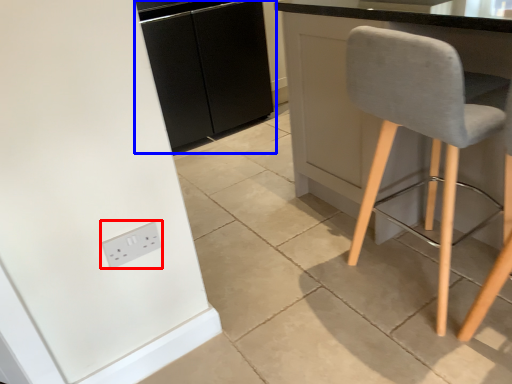
Question: Which of the following is the farthest to the observer, socket (highlighted by a red box) or cabinetry (highlighted by a blue box)?

Choices:
 (A) socket
 (B) cabinetry

Answer: (B)